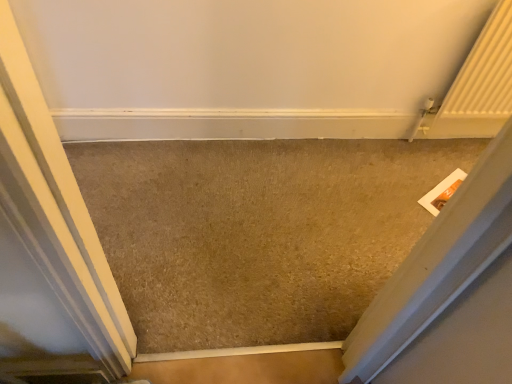
Question: Is beige carpet at center bigger or smaller than white matte door at left?

Choices:
 (A) big
 (B) small

Answer: (B)

Question: Is point (95, 152) closer or farther from the camera than point (9, 210)?

Choices:
 (A) closer
 (B) farther

Answer: (B)

Question: Is beige carpet at center situated inside white matte door at left or outside?

Choices:
 (A) inside
 (B) outside

Answer: (B)

Question: Is white matte door at left bigger or smaller than beige carpet at center?

Choices:
 (A) small
 (B) big

Answer: (B)

Question: Does point (29, 253) appear closer or farther from the camera than point (318, 279)?

Choices:
 (A) farther
 (B) closer

Answer: (B)

Question: Looking at their shapes, would you say white matte door at left is wider or thinner than beige carpet at center?

Choices:
 (A) thin
 (B) wide

Answer: (A)

Question: Which is correct: white matte door at left is inside beige carpet at center, or outside of it?

Choices:
 (A) outside
 (B) inside

Answer: (A)